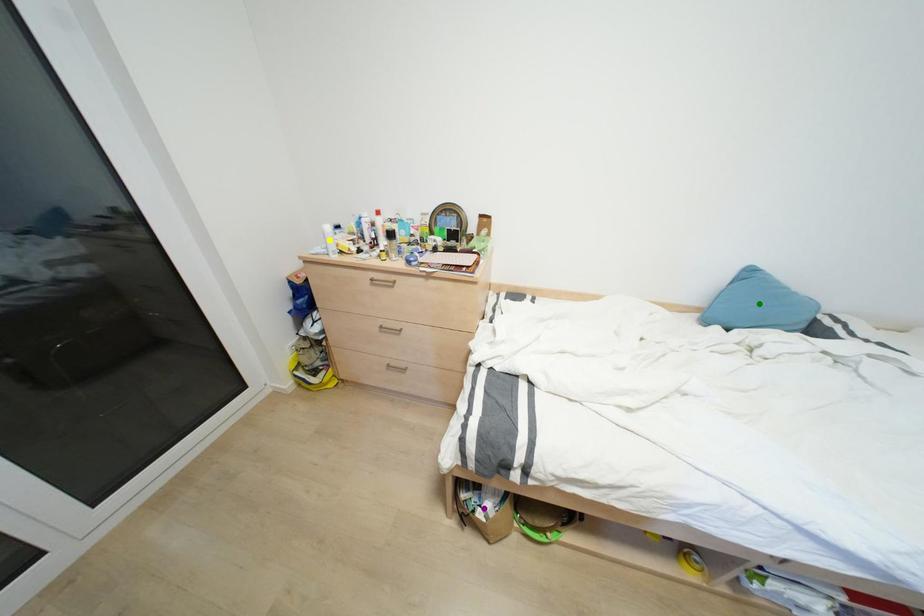
Order these from farthest to nearest:
yellow point
purple point
green point

yellow point < green point < purple point